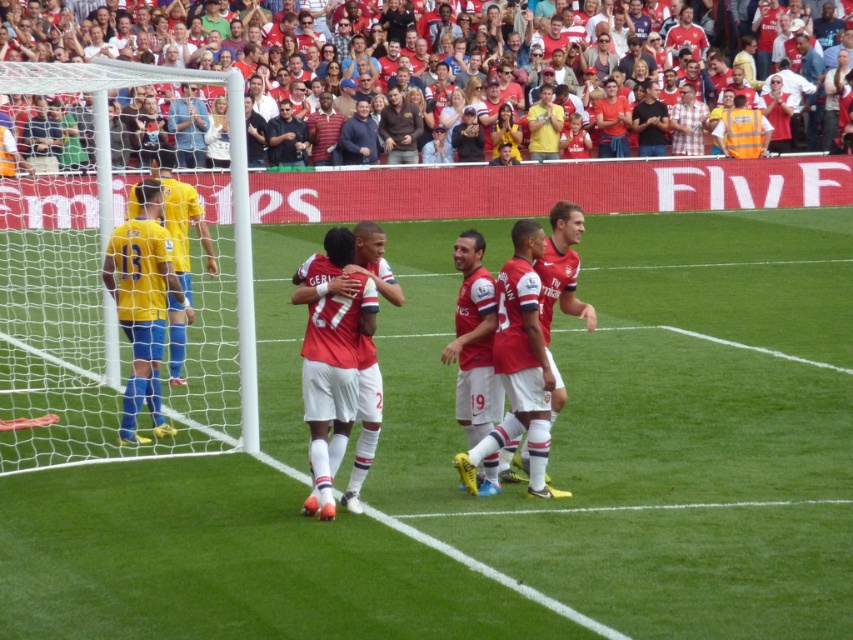
You are a photographer standing at the edge of the soccer field. You want to take a picture that includes both the green grass at center and the dark blue sweater at upper center. Which object will appear larger in the photo?

The green grass at center will appear larger in the photo because it has a greater height compared to the dark blue sweater at upper center.

You are a soccer player standing on the field and want to sprint towards the goal located at the far end of the field. However, you notice the red fabric crowd at upper center and the green grass at center. Which direction should you sprint to avoid the crowd and reach the goal quickly?

You should sprint towards the green grass at center since it is to the right of the red fabric crowd at upper center, allowing you to avoid the crowd and head towards the goal more directly.

You are a photographer taking a picture of the soccer match. You notice the brown cotton shirt at center and the yellow jersey at upper center. Which one will be more visible in your photo due to their positions?

The brown cotton shirt at center will be more visible in the photo because it is in front of the yellow jersey at upper center, making it appear closer to the camera.